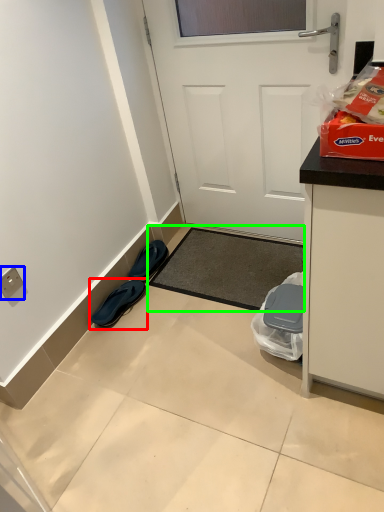
Question: Estimate the real-world distances between objects in this image. Which object is farther from footwear (highlighted by a red box), electric outlet (highlighted by a blue box) or doormat (highlighted by a green box)?

Choices:
 (A) electric outlet
 (B) doormat

Answer: (A)